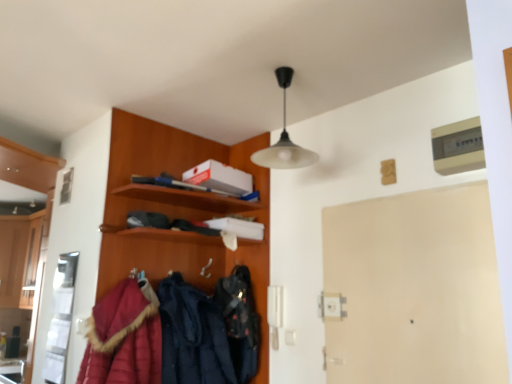
This screenshot has width=512, height=384. What do you see at coordinates (124, 337) in the screenshot? I see `quilted red coat at lower left` at bounding box center [124, 337].

Measure the distance between point [255,313] and camera.

Point [255,313] and camera are 8.12 feet apart.

What do you see at coordinates (284, 139) in the screenshot? I see `matte black pendant light at upper center` at bounding box center [284, 139].

Describe the element at coordinates (18, 255) in the screenshot. I see `brushed metal cabinet at left` at that location.

Measure the distance between wooden coat rack at upper left and camera.

The distance of wooden coat rack at upper left from camera is 2.17 meters.

Locate an element on the screen. Image resolution: width=512 pixels, height=384 pixels. quilted red coat at lower left is located at coordinates (124, 337).

From the image's perspective, is beige matte door at center on top of quilted red coat at lower left?

Correct, beige matte door at center appears higher than quilted red coat at lower left in the image.

Is beige matte door at center surrounding quilted red coat at lower left?

No.

Are beige matte door at center and quilted red coat at lower left located far from each other?

Yes, beige matte door at center and quilted red coat at lower left are quite far apart.

Would you consider quilted red coat at lower left to be distant from velvet black bag at center, acting as the 2th clothing starting from the left?

That's not correct — quilted red coat at lower left is a little close to velvet black bag at center, acting as the 2th clothing starting from the left.

Relative to velvet black bag at center, acting as the 2th clothing starting from the left, is quilted red coat at lower left in front or behind?

Visually, quilted red coat at lower left is located in front of velvet black bag at center, acting as the 2th clothing starting from the left.

Find the location of `cloak in front of the velvet black bag at center, acting as the 2th clothing starting from the left`. cloak in front of the velvet black bag at center, acting as the 2th clothing starting from the left is located at coordinates tap(124, 337).

Considering the relative positions of quilted red coat at lower left and velvet black bag at center, positioned as the first clothing in right-to-left order, in the image provided, is quilted red coat at lower left to the right of velvet black bag at center, positioned as the first clothing in right-to-left order, from the viewer's perspective?

No, quilted red coat at lower left is not to the right of velvet black bag at center, positioned as the first clothing in right-to-left order.

Could you tell me if wooden coat rack at upper left is facing matte black pendant light at upper center?

Yes, wooden coat rack at upper left is turned towards matte black pendant light at upper center.

Considering the sizes of objects wooden coat rack at upper left and matte black pendant light at upper center in the image provided, who is wider, wooden coat rack at upper left or matte black pendant light at upper center?

wooden coat rack at upper left.

Is there a large distance between wooden coat rack at upper left and matte black pendant light at upper center?

Actually, wooden coat rack at upper left and matte black pendant light at upper center are a little close together.

At what (x,y) coordinates should I click in order to perform the action: click on light fixture located in front of the wooden coat rack at upper left. Please return your answer as a coordinate pair (x, y). This screenshot has width=512, height=384. Looking at the image, I should click on (284, 139).

Is brushed metal cabinet at left not near beige matte door at center?

That's right, there is a large distance between brushed metal cabinet at left and beige matte door at center.

From a real-world perspective, between brushed metal cabinet at left and beige matte door at center, who is vertically higher?

In real-world perspective, brushed metal cabinet at left is above.

Based on the photo, is brushed metal cabinet at left oriented away from beige matte door at center?

brushed metal cabinet at left is not turned away from beige matte door at center.

Can you confirm if brushed metal cabinet at left is taller than beige matte door at center?

Indeed, brushed metal cabinet at left has a greater height compared to beige matte door at center.

From a real-world perspective, is matte black pendant light at upper center physically located above or below velvet-like navy blue coat at center, marked as the 2th clothing in a right-to-left arrangement?

matte black pendant light at upper center is above velvet-like navy blue coat at center, marked as the 2th clothing in a right-to-left arrangement.

Is matte black pendant light at upper center completely or partially outside of velvet-like navy blue coat at center, which ranks as the 1th clothing in left-to-right order?

matte black pendant light at upper center lies outside velvet-like navy blue coat at center, which ranks as the 1th clothing in left-to-right order,'s area.

Between matte black pendant light at upper center and velvet-like navy blue coat at center, marked as the 2th clothing in a right-to-left arrangement, which one has more height?

velvet-like navy blue coat at center, marked as the 2th clothing in a right-to-left arrangement, is taller.

Which is in front, matte black pendant light at upper center or velvet-like navy blue coat at center, which ranks as the 1th clothing in left-to-right order?

matte black pendant light at upper center is in front.

Is beige matte door at center positioned far away from velvet-like navy blue coat at center, marked as the 2th clothing in a right-to-left arrangement?

That's not correct — beige matte door at center is a little close to velvet-like navy blue coat at center, marked as the 2th clothing in a right-to-left arrangement.

Considering the relative positions of beige matte door at center and velvet-like navy blue coat at center, marked as the 2th clothing in a right-to-left arrangement, in the image provided, is beige matte door at center to the left of velvet-like navy blue coat at center, marked as the 2th clothing in a right-to-left arrangement, from the viewer's perspective?

In fact, beige matte door at center is to the right of velvet-like navy blue coat at center, marked as the 2th clothing in a right-to-left arrangement.

Considering the points (505, 343) and (158, 292), which point is in front, point (505, 343) or point (158, 292)?

The point (505, 343) is in front.

Can you confirm if beige matte door at center is smaller than velvet-like navy blue coat at center, which ranks as the 1th clothing in left-to-right order?

Correct, beige matte door at center occupies less space than velvet-like navy blue coat at center, which ranks as the 1th clothing in left-to-right order.

Considering the sizes of objects matte black pendant light at upper center and velvet black bag at center, positioned as the first clothing in right-to-left order, in the image provided, who is bigger, matte black pendant light at upper center or velvet black bag at center, positioned as the first clothing in right-to-left order,?

With larger size is matte black pendant light at upper center.

Is matte black pendant light at upper center beside velvet black bag at center, positioned as the first clothing in right-to-left order?

No, matte black pendant light at upper center is not next to velvet black bag at center, positioned as the first clothing in right-to-left order.

Which is closer to the camera, (278, 72) or (231, 314)?

Point (278, 72) is closer to the camera than point (231, 314).

You are a GUI agent. You are given a task and a screenshot of the screen. Output one action in this format:
    pyautogui.click(x=<x>, y=<y>)
    Task: Click on the cloak below the beige matte door at center (from the image's perspective)
    Image resolution: width=512 pixels, height=384 pixels.
    Given the screenshot: What is the action you would take?
    pyautogui.click(x=124, y=337)

Find the location of `cloak located above the velvet black bag at center, acting as the 2th clothing starting from the left (from a real-world perspective)`. cloak located above the velvet black bag at center, acting as the 2th clothing starting from the left (from a real-world perspective) is located at coordinates (124, 337).

Considering their positions, is beige matte door at center positioned closer to brushed metal cabinet at left than velvet-like navy blue coat at center, which ranks as the 1th clothing in left-to-right order?

Among the two, velvet-like navy blue coat at center, which ranks as the 1th clothing in left-to-right order, is located nearer to brushed metal cabinet at left.

Looking at the image, which one is located closer to quilted red coat at lower left, velvet black bag at center, acting as the 2th clothing starting from the left, or beige matte door at center?

velvet black bag at center, acting as the 2th clothing starting from the left, is positioned closer to the anchor quilted red coat at lower left.

Based on their spatial positions, is quilted red coat at lower left or beige matte door at center closer to velvet black bag at center, acting as the 2th clothing starting from the left?

quilted red coat at lower left lies closer to velvet black bag at center, acting as the 2th clothing starting from the left, than the other object.

When comparing their distances from matte black pendant light at upper center, does velvet black bag at center, positioned as the first clothing in right-to-left order, or brushed metal cabinet at left seem further?

Among the two, brushed metal cabinet at left is located further to matte black pendant light at upper center.

Based on their spatial positions, is wooden coat rack at upper left or brushed metal cabinet at left closer to matte black pendant light at upper center?

wooden coat rack at upper left.

Based on their spatial positions, is matte black pendant light at upper center or wooden coat rack at upper left further from beige matte door at center?

wooden coat rack at upper left is positioned further to the anchor beige matte door at center.

Estimate the real-world distances between objects in this image. Which object is further from quilted red coat at lower left, velvet-like navy blue coat at center, marked as the 2th clothing in a right-to-left arrangement, or brushed metal cabinet at left?

Based on the image, brushed metal cabinet at left appears to be further to quilted red coat at lower left.

From the image, which object appears to be farther from quilted red coat at lower left, beige matte door at center or velvet-like navy blue coat at center, marked as the 2th clothing in a right-to-left arrangement?

beige matte door at center.

Image resolution: width=512 pixels, height=384 pixels. I want to click on light fixture between quilted red coat at lower left and beige matte door at center, so click(x=284, y=139).

At what (x,y) coordinates should I click in order to perform the action: click on door between matte black pendant light at upper center and velvet black bag at center, acting as the 2th clothing starting from the left, vertically. Please return your answer as a coordinate pair (x, y). This screenshot has height=384, width=512. Looking at the image, I should click on (415, 289).

Locate an element on the screen. The width and height of the screenshot is (512, 384). clothing between brushed metal cabinet at left and velvet black bag at center, positioned as the first clothing in right-to-left order, in the horizontal direction is located at coordinates [192, 335].

Where is `clothing between matte black pendant light at upper center and velvet black bag at center, positioned as the first clothing in right-to-left order, in the up-down direction`? This screenshot has width=512, height=384. clothing between matte black pendant light at upper center and velvet black bag at center, positioned as the first clothing in right-to-left order, in the up-down direction is located at coordinates (192, 335).